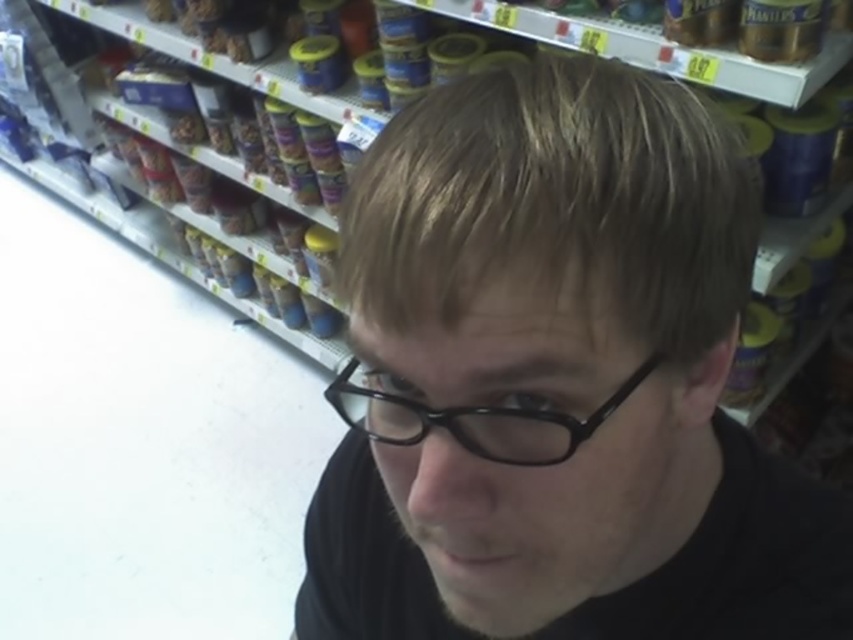
Which of these two, black matte glasses at center or yellow plastic jars at upper center, stands shorter?

With less height is black matte glasses at center.

Between point (619, 564) and point (267, 192), which one is positioned in front?

Positioned in front is point (619, 564).

This screenshot has width=853, height=640. I want to click on black matte glasses at center, so click(556, 380).

Describe the element at coordinates (170, 120) in the screenshot. I see `yellow plastic jars at upper center` at that location.

Who is more forward, (166, 120) or (402, 442)?

Point (402, 442) is in front.

Is point (213, 58) positioned in front of point (351, 388)?

No, (213, 58) is further to viewer.

Find the location of a particular element. This screenshot has width=853, height=640. yellow plastic jars at upper center is located at coordinates (170, 120).

Between black matte glasses at center and black plastic glasses at center, which one is positioned lower?

black plastic glasses at center is lower down.

Is black matte glasses at center smaller than black plastic glasses at center?

Actually, black matte glasses at center might be larger than black plastic glasses at center.

This screenshot has height=640, width=853. What do you see at coordinates (556, 380) in the screenshot? I see `black matte glasses at center` at bounding box center [556, 380].

At what (x,y) coordinates should I click in order to perform the action: click on black matte glasses at center. Please return your answer as a coordinate pair (x, y). The width and height of the screenshot is (853, 640). Looking at the image, I should click on (556, 380).